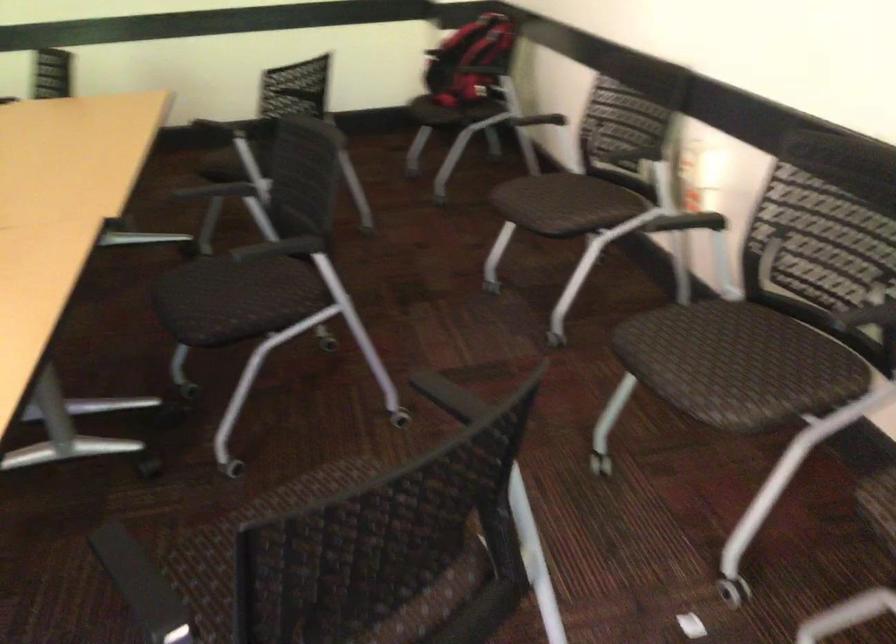
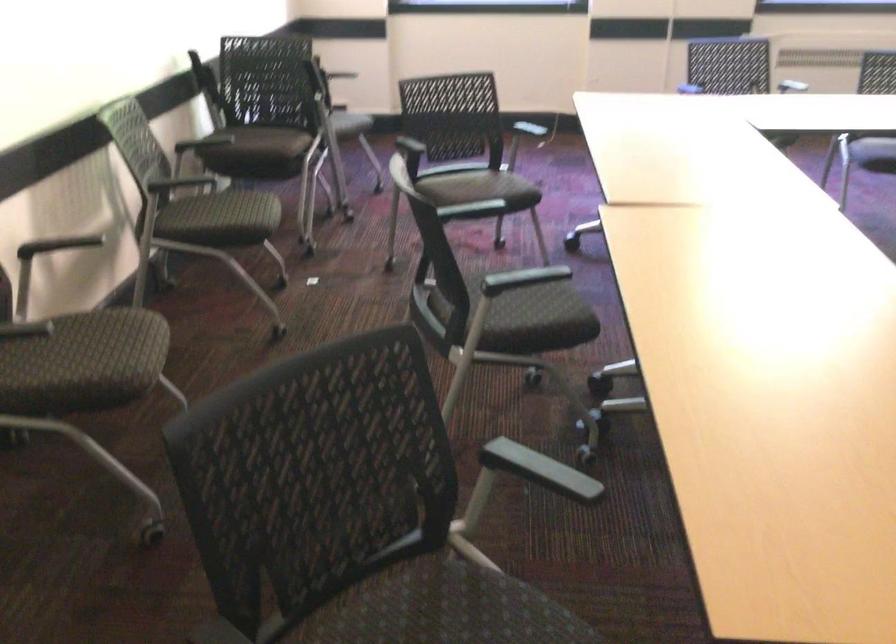
Where in the second image is the point corresponding to [219,272] from the first image?

(530, 319)